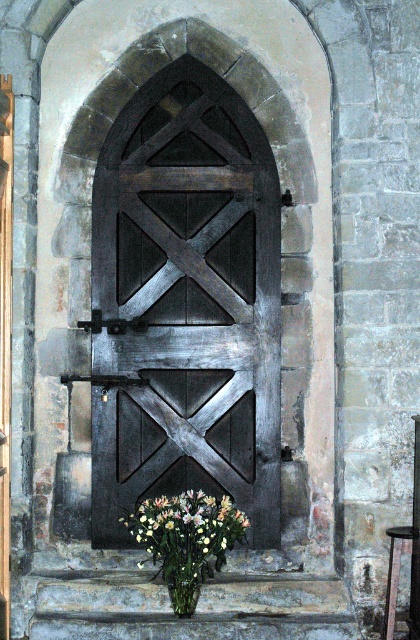
Question: Which object is the closest to the dark wood barn door at center?

Choices:
 (A) green matte vase at lower center
 (B) white matte vase at center

Answer: (B)

Question: Considering the relative positions of dark wood barn door at center and white matte vase at center in the image provided, where is dark wood barn door at center located with respect to white matte vase at center?

Choices:
 (A) right
 (B) left

Answer: (B)

Question: Can you confirm if white matte vase at center is positioned above green matte vase at lower center?

Choices:
 (A) yes
 (B) no

Answer: (A)

Question: Which object is positioned closest to the dark wood barn door at center?

Choices:
 (A) green matte vase at lower center
 (B) white matte vase at center

Answer: (B)

Question: Can you confirm if dark wood barn door at center is positioned to the left of green matte vase at lower center?

Choices:
 (A) no
 (B) yes

Answer: (A)

Question: Among these objects, which one is nearest to the camera?

Choices:
 (A) dark wood barn door at center
 (B) green matte vase at lower center

Answer: (B)